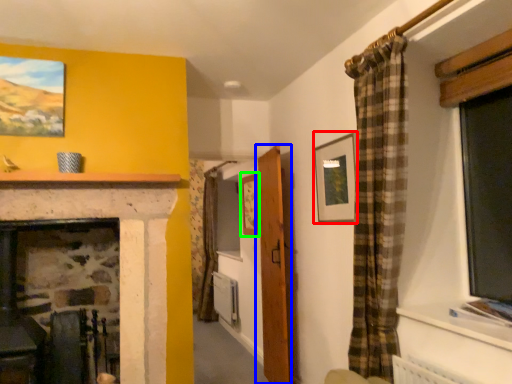
Question: Which object is the farthest from picture frame (highlighted by a red box)? Choose among these: door (highlighted by a blue box) or picture frame (highlighted by a green box).

Choices:
 (A) door
 (B) picture frame

Answer: (B)